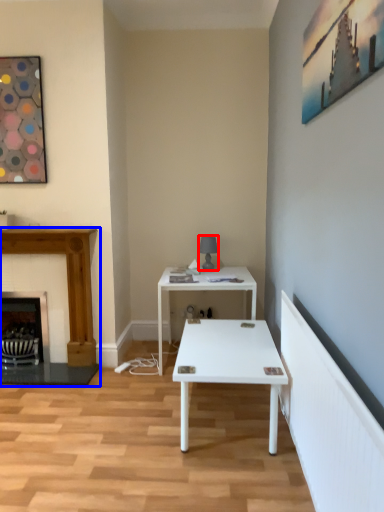
Question: Which of the following is the farthest to the observer, table lamp (highlighted by a red box) or fireplace (highlighted by a blue box)?

Choices:
 (A) table lamp
 (B) fireplace

Answer: (A)